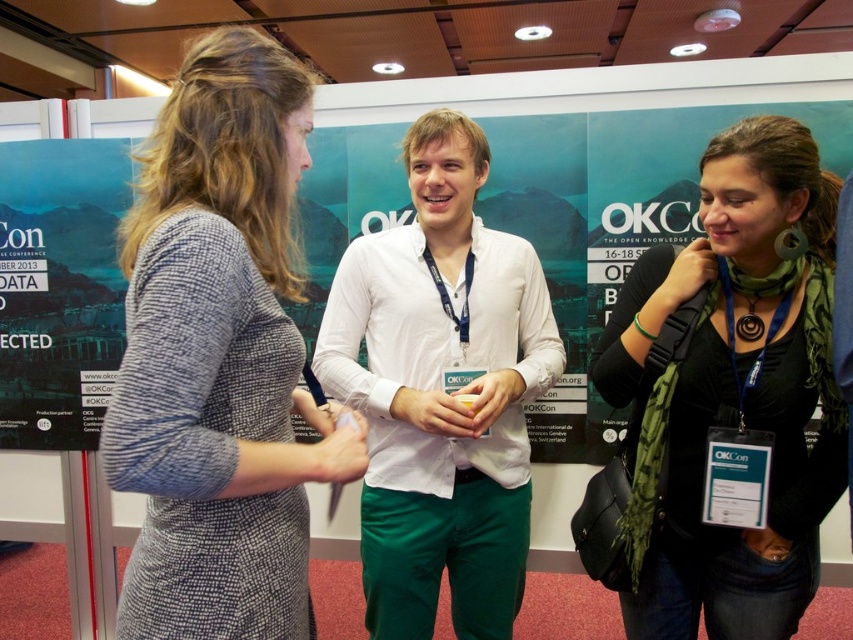
Question: Does green fabric scarf at center appear on the left side of matte paper poster at left?

Choices:
 (A) no
 (B) yes

Answer: (A)

Question: Can you confirm if textured gray dress at center is positioned above green fabric scarf at center?

Choices:
 (A) no
 (B) yes

Answer: (B)

Question: Which object is farther from the camera taking this photo?

Choices:
 (A) textured gray dress at center
 (B) matte paper poster at left
 (C) matte black poster at upper left

Answer: (B)

Question: Can you confirm if textured gray dress at center is wider than matte paper poster at left?

Choices:
 (A) no
 (B) yes

Answer: (A)

Question: Which object is closer to the camera taking this photo?

Choices:
 (A) matte paper poster at left
 (B) green fabric scarf at center
 (C) matte black poster at upper left
 (D) textured gray dress at center

Answer: (D)

Question: Considering the real-world distances, which object is closest to the matte paper poster at left?

Choices:
 (A) textured gray dress at center
 (B) green fabric scarf at center

Answer: (A)